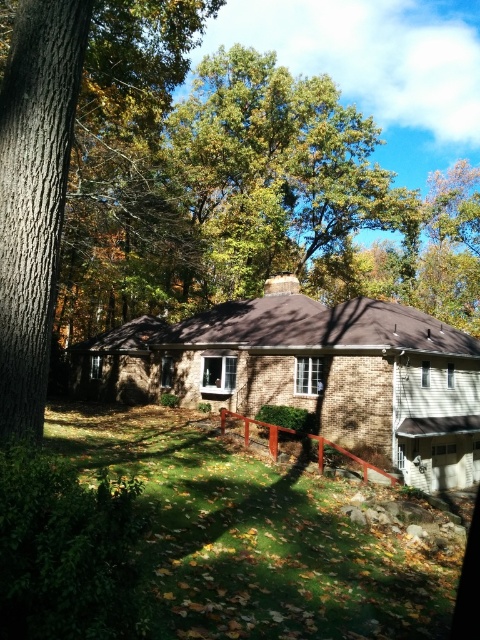
Can you confirm if green grass at lower center is positioned to the left of smooth brown bark at left?

In fact, green grass at lower center is to the right of smooth brown bark at left.

From the picture: Can you confirm if green grass at lower center is shorter than smooth brown bark at left?

No, green grass at lower center is not shorter than smooth brown bark at left.

What are the coordinates of `green grass at lower center` in the screenshot? It's located at coord(214,545).

In order to click on green grass at lower center in this screenshot , I will do `click(214, 545)`.